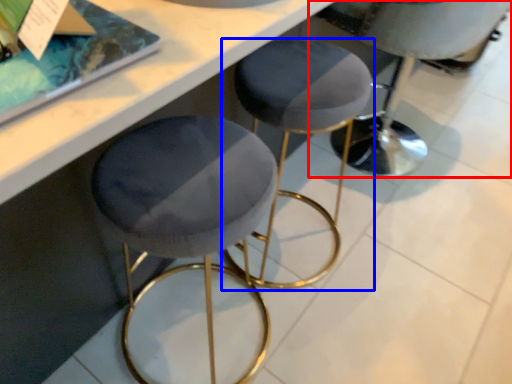
Question: Among these objects, which one is nearest to the camera, swivel chair (highlighted by a red box) or stool (highlighted by a blue box)?

Choices:
 (A) swivel chair
 (B) stool

Answer: (B)